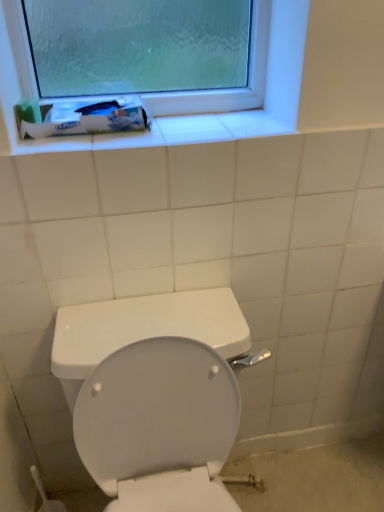
Question: From the image's perspective, is white glossy toilet at center above or below white matte tube at upper left?

Choices:
 (A) below
 (B) above

Answer: (A)

Question: Is point (124, 313) closer or farther from the camera than point (137, 112)?

Choices:
 (A) farther
 (B) closer

Answer: (A)

Question: From a real-world perspective, relative to white matte tube at upper left, is white glossy toilet at center vertically above or below?

Choices:
 (A) above
 (B) below

Answer: (B)

Question: From their relative heights in the image, would you say white matte tube at upper left is taller or shorter than white glossy toilet at center?

Choices:
 (A) short
 (B) tall

Answer: (A)

Question: In terms of width, does white matte tube at upper left look wider or thinner when compared to white glossy toilet at center?

Choices:
 (A) wide
 (B) thin

Answer: (B)

Question: Which is correct: white matte tube at upper left is inside white glossy toilet at center, or outside of it?

Choices:
 (A) inside
 (B) outside

Answer: (B)

Question: From a real-world perspective, is white matte tube at upper left physically located above or below white glossy toilet at center?

Choices:
 (A) below
 (B) above

Answer: (B)